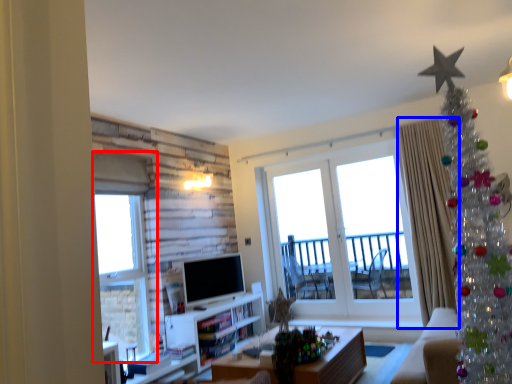
Question: Which point is further to the camera, window (highlighted by a red box) or curtain (highlighted by a blue box)?

Choices:
 (A) window
 (B) curtain

Answer: (B)